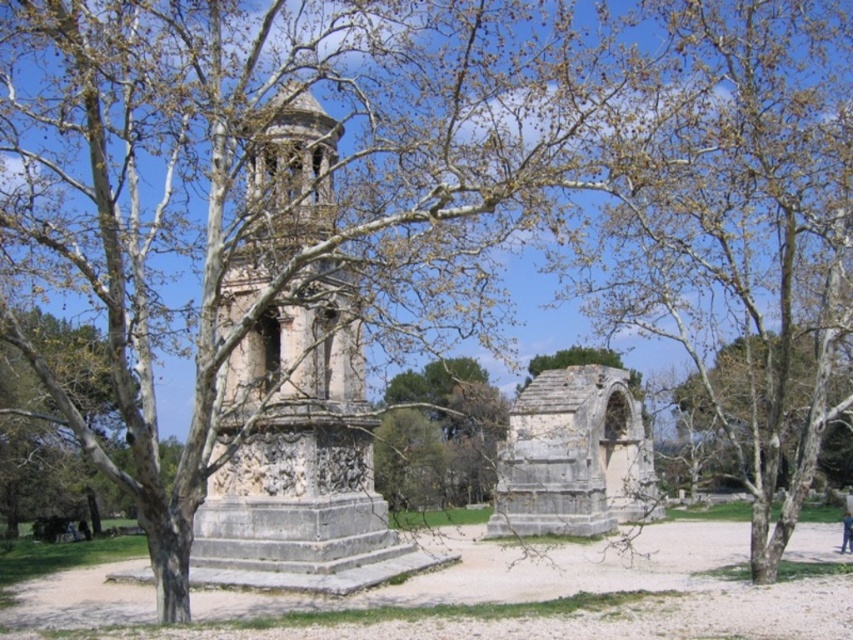
Question: Considering the real-world distances, which object is closest to the brown leafy tree at center?

Choices:
 (A) stone tower at center
 (B) gray stone arch at center

Answer: (B)

Question: In this image, where is gray stone arch at center located relative to brown leafy tree at center?

Choices:
 (A) right
 (B) left

Answer: (A)

Question: Which is farther from the stone tower at center?

Choices:
 (A) brown leafy tree at center
 (B) gray stone arch at center

Answer: (B)

Question: Is stone tower at center above gray stone arch at center?

Choices:
 (A) no
 (B) yes

Answer: (B)

Question: Is the position of gray stone arch at center more distant than that of brown leafy tree at center?

Choices:
 (A) no
 (B) yes

Answer: (B)

Question: Which point is closer to the camera taking this photo?

Choices:
 (A) (229, 397)
 (B) (578, 536)
 (C) (401, 420)

Answer: (A)